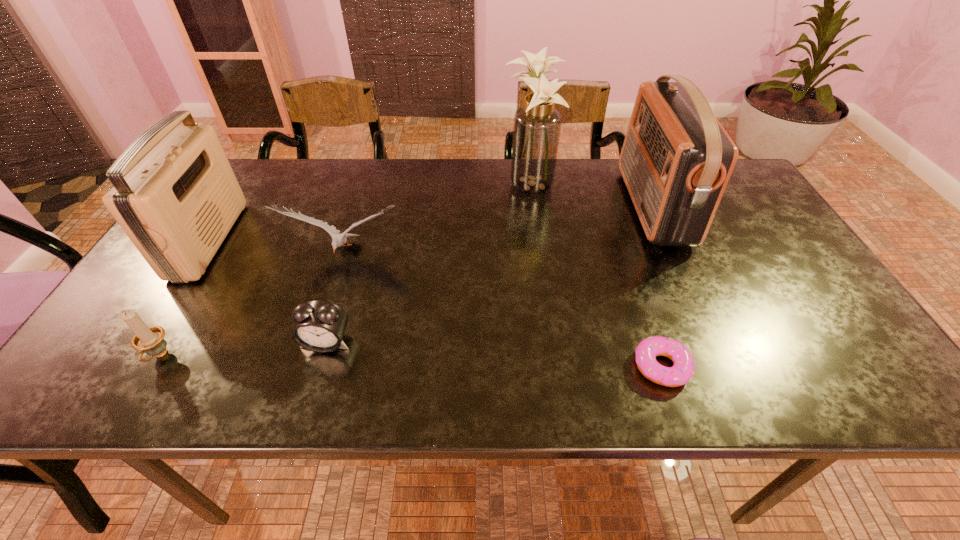
In order to click on the third object from right to left in this screenshot , I will do `click(537, 125)`.

Locate an element on the screen. The image size is (960, 540). the right radio receiver is located at coordinates (676, 160).

The height and width of the screenshot is (540, 960). What are the coordinates of `the left radio receiver` in the screenshot? It's located at (175, 195).

The image size is (960, 540). What are the coordinates of `gull` in the screenshot? It's located at point(338,240).

Locate an element on the screen. This screenshot has width=960, height=540. candle_holder is located at coordinates (150, 340).

Identify the location of the sixth tallest object. (320, 326).

Identify the location of the second object from right to left. (683, 369).

Where is `the shortest object`? This screenshot has height=540, width=960. the shortest object is located at coordinates (683, 369).

You are a GUI agent. You are given a task and a screenshot of the screen. Output one action in this format:
    pyautogui.click(x=<x>, y=<y>)
    Task: Click on the vacant space located on the front of the flower arrangement
    The height and width of the screenshot is (540, 960).
    Given the screenshot: What is the action you would take?
    click(x=542, y=302)

Locate an element on the screen. free space located 0.060m on the front-facing side of the right radio receiver is located at coordinates (609, 206).